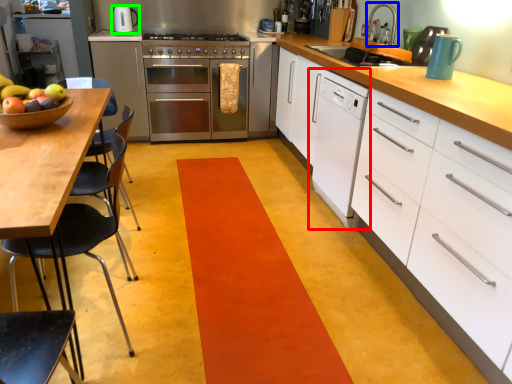
Question: Based on their relative distances, which object is nearer to home appliance (highlighted by a red box)? Choose from appliance (highlighted by a blue box) and kitchen appliance (highlighted by a green box).

Choices:
 (A) appliance
 (B) kitchen appliance

Answer: (A)